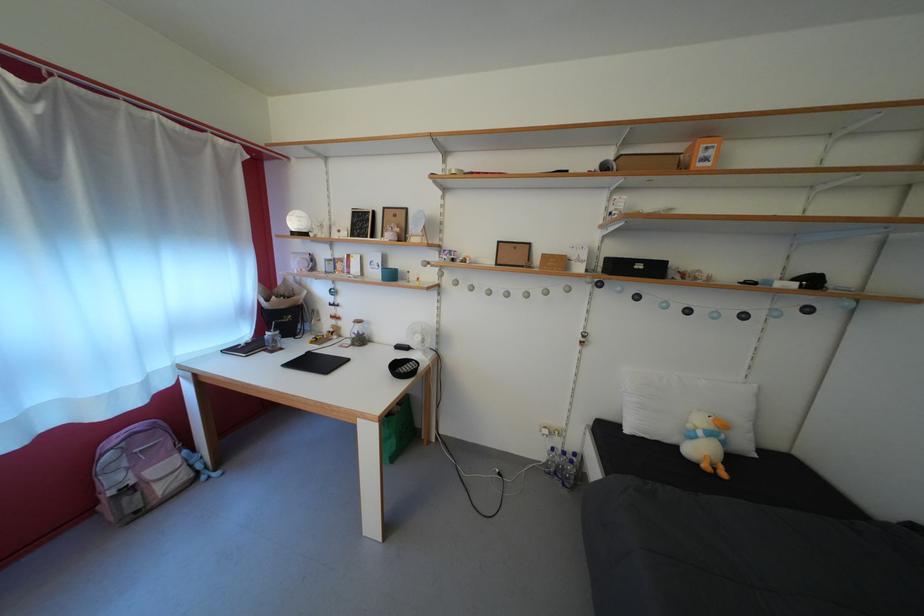
Identify the location of black storage box. The height and width of the screenshot is (616, 924). (635, 267).